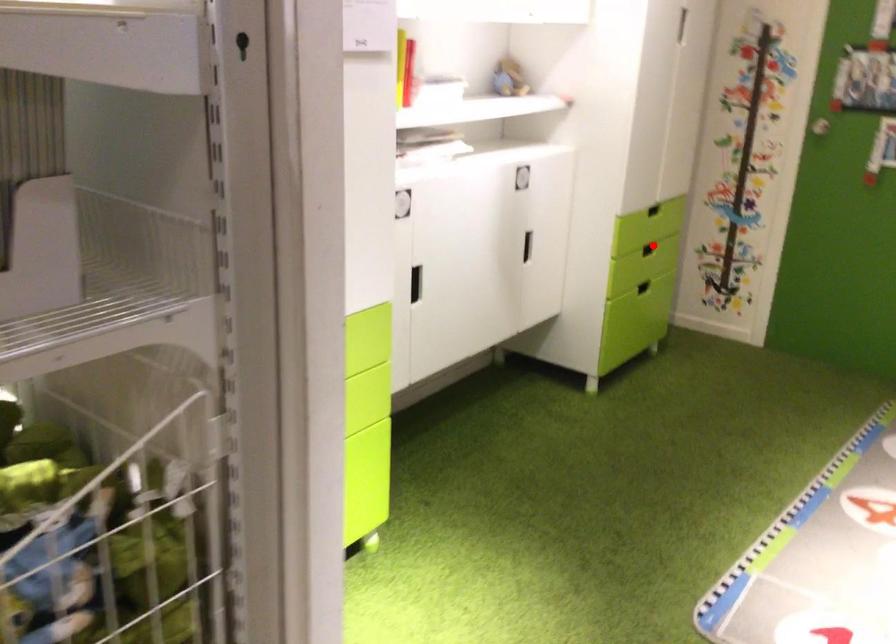
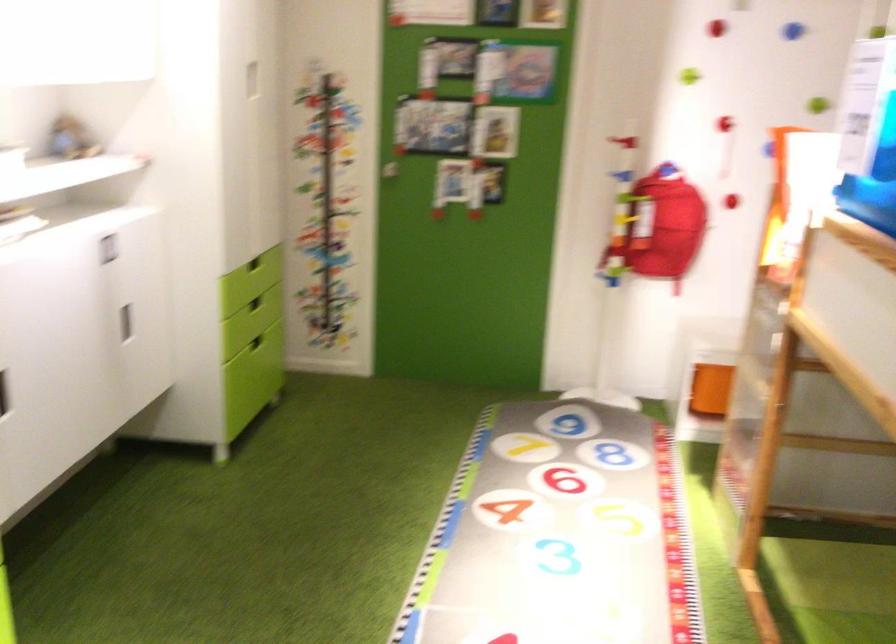
Where in the second image is the point corresponding to the highlighted location from the first image?

(254, 303)